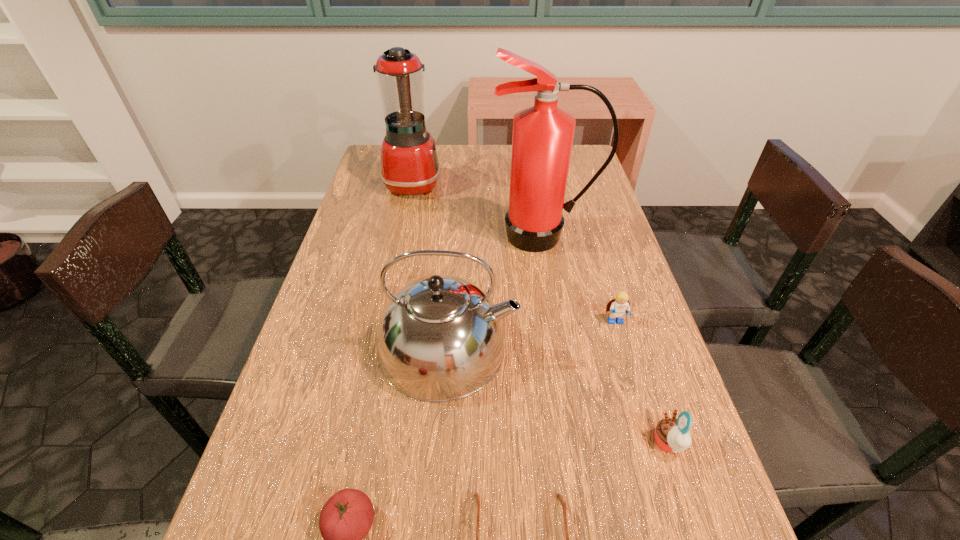
Where is `vacant space situated on the front-facing side of the Lego`? The image size is (960, 540). vacant space situated on the front-facing side of the Lego is located at coordinates (670, 508).

Identify the location of free location located on the front-facing side of the muffin. (586, 443).

The image size is (960, 540). Identify the location of free spot located 0.060m on the front-facing side of the muffin. (619, 443).

This screenshot has height=540, width=960. Find the location of `free space located 0.190m on the front-facing side of the muffin`. free space located 0.190m on the front-facing side of the muffin is located at coordinates (546, 443).

Locate an element on the screen. The height and width of the screenshot is (540, 960). object that is positioned at the far edge is located at coordinates (410, 166).

Locate an element on the screen. The height and width of the screenshot is (540, 960). object situated at the left edge is located at coordinates (410, 166).

Where is `fire extinguisher situated at the right edge`? fire extinguisher situated at the right edge is located at coordinates (542, 138).

Find the location of a particular element. Lego at the right edge is located at coordinates (619, 307).

You are a GUI agent. You are given a task and a screenshot of the screen. Output one action in this format:
    pyautogui.click(x=<x>, y=<y>)
    Task: Click on the muffin located at the right edge
    
    Given the screenshot: What is the action you would take?
    pyautogui.click(x=672, y=435)

The width and height of the screenshot is (960, 540). What are the coordinates of `object that is at the far left corner` in the screenshot? It's located at (410, 166).